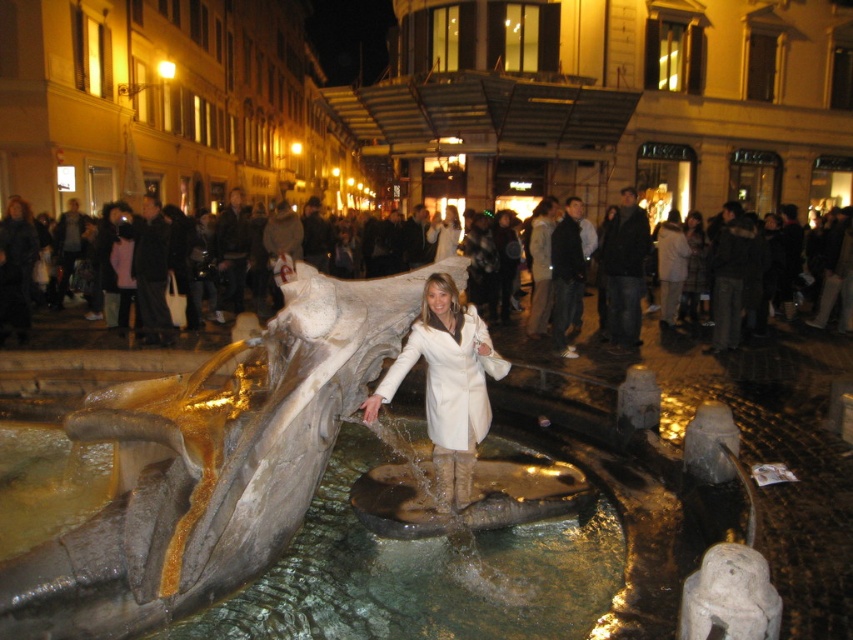
At what (x,y) coordinates should I click in order to perform the action: click on translucent stone water at center. Please return your answer as a coordinate pair (x, y). Image resolution: width=853 pixels, height=640 pixels. Looking at the image, I should click on (422, 572).

Does point (550, 611) come farther from viewer compared to point (48, 324)?

No, (550, 611) is in front of (48, 324).

Is point (410, 419) behind point (107, 346)?

No, (410, 419) is closer to viewer.

Where is `translucent stone water at center`? translucent stone water at center is located at coordinates (422, 572).

Find the location of a particular element. Image resolution: width=853 pixels, height=640 pixels. translucent stone water at center is located at coordinates (422, 572).

Does translucent stone water at center appear on the right side of white leather coat at center?

Yes, translucent stone water at center is to the right of white leather coat at center.

Who is more distant from viewer, [312,602] or [440,486]?

Point [440,486]

Find the location of a particular element. Image resolution: width=853 pixels, height=640 pixels. translucent stone water at center is located at coordinates (422, 572).

Is point (485, 416) farther from camera compared to point (55, 348)?

No, (485, 416) is closer to viewer.

Can you confirm if white leather coat at center is smaller than white textured crowd at center?

Yes.

Where is `white leather coat at center`? white leather coat at center is located at coordinates (445, 385).

This screenshot has height=640, width=853. Find the location of `white leather coat at center`. white leather coat at center is located at coordinates (445, 385).